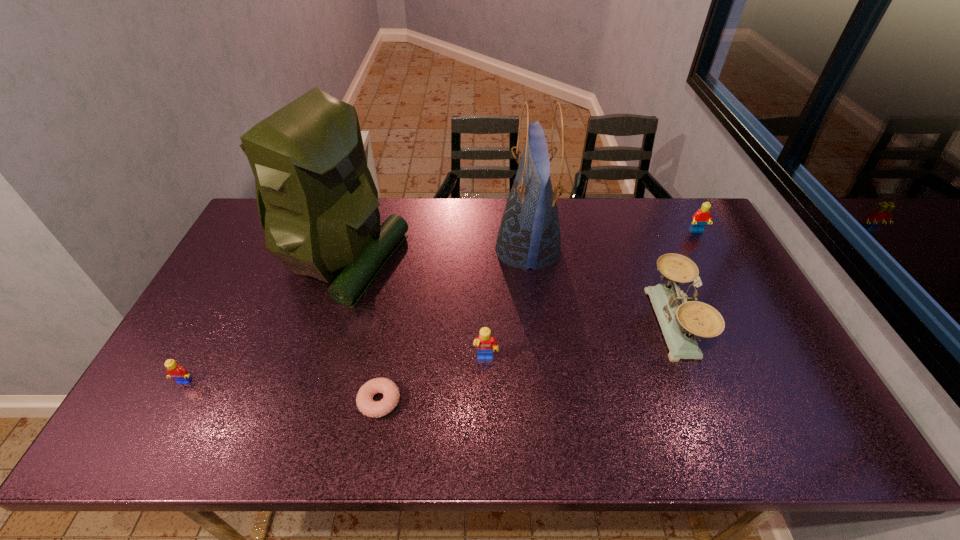
The height and width of the screenshot is (540, 960). Find the location of `vacant space at the near edge`. vacant space at the near edge is located at coordinates (710, 441).

What are the coordinates of `vacant space at the right edge of the desktop` in the screenshot? It's located at (777, 355).

The image size is (960, 540). Find the location of `free space at the near left corner`. free space at the near left corner is located at coordinates (180, 415).

The height and width of the screenshot is (540, 960). I want to click on free space at the near right corner, so click(x=813, y=424).

Where is `vacant space in between the leftmost object and the third object from right to left`? vacant space in between the leftmost object and the third object from right to left is located at coordinates (356, 315).

Locate an element on the screen. unoccupied area between the backpack and the fourth object from left to right is located at coordinates (414, 310).

Where is `empty location between the leftmost Lego and the backpack`? The height and width of the screenshot is (540, 960). empty location between the leftmost Lego and the backpack is located at coordinates (263, 321).

Where is `vacant space that's between the shortest Lego and the fifth object from left to right`? The width and height of the screenshot is (960, 540). vacant space that's between the shortest Lego and the fifth object from left to right is located at coordinates (356, 315).

I want to click on free space between the backpack and the fifth shortest object, so click(x=507, y=292).

Locate an element on the screen. The image size is (960, 540). free space that is in between the backpack and the shopping bag is located at coordinates (435, 254).